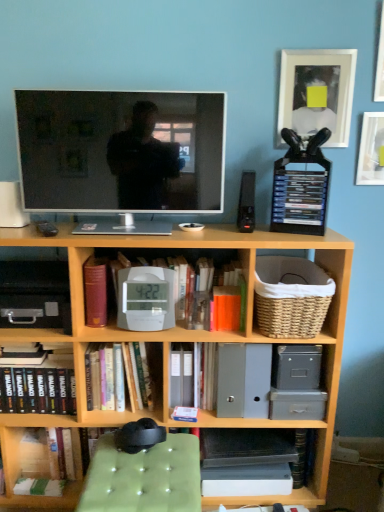
Image resolution: width=384 pixels, height=512 pixels. Find the location of `vacant point above green fabric ottoman at lower center (from a real-world perspective)`. vacant point above green fabric ottoman at lower center (from a real-world perspective) is located at coordinates (151, 463).